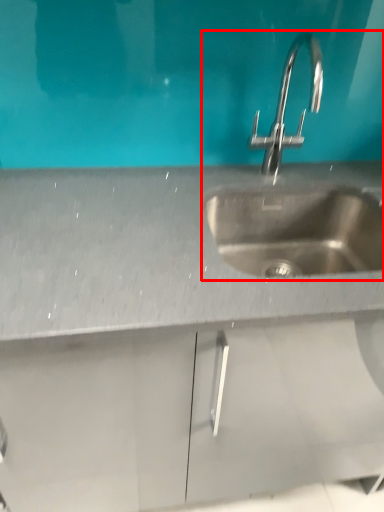
Question: Where is sink (annotated by the red box) located in relation to sink in the image?

Choices:
 (A) right
 (B) left

Answer: (B)